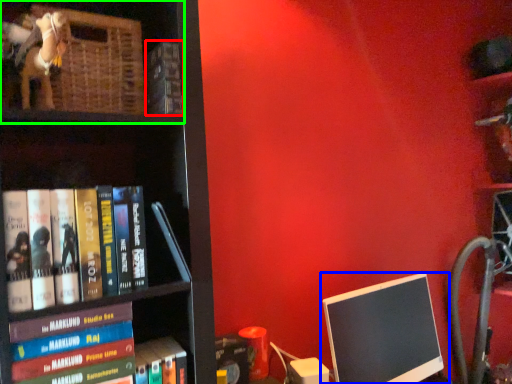
Question: Considering the real-world distances, which object is closest to book (highlighted by a red box)? computer monitor (highlighted by a blue box) or shelf (highlighted by a green box).

Choices:
 (A) computer monitor
 (B) shelf

Answer: (B)